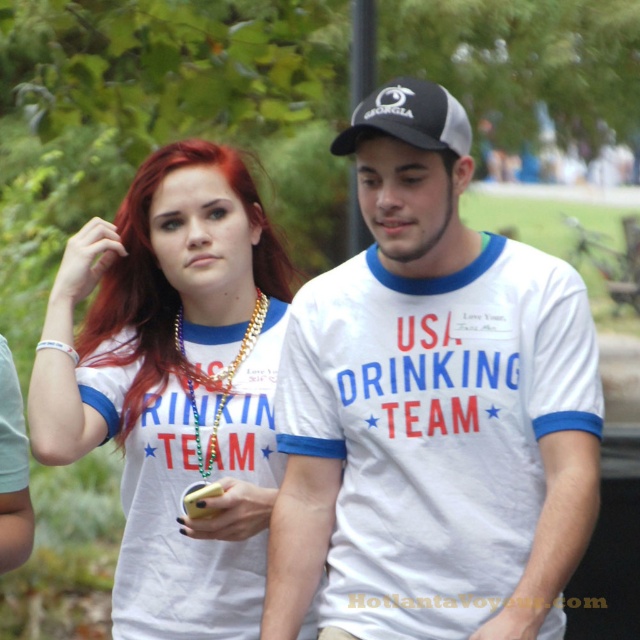
Question: Estimate the real-world distances between objects in this image. Which object is farther from the gold chain necklace at center?

Choices:
 (A) white cotton t-shirt at center
 (B) black mesh cap at upper center
 (C) white matte t-shirt at center

Answer: (B)

Question: Can you confirm if white cotton t-shirt at center is smaller than white matte t-shirt at center?

Choices:
 (A) no
 (B) yes

Answer: (A)

Question: Which object is positioned farthest from the white matte t-shirt at center?

Choices:
 (A) gold chain necklace at center
 (B) white cotton t-shirt at center

Answer: (B)

Question: Can you confirm if white cotton t-shirt at center is bigger than gold chain necklace at center?

Choices:
 (A) yes
 (B) no

Answer: (A)

Question: Is white cotton t-shirt at center closer to camera compared to white matte t-shirt at center?

Choices:
 (A) no
 (B) yes

Answer: (B)

Question: Which object is positioned farthest from the gold chain necklace at center?

Choices:
 (A) white matte t-shirt at center
 (B) white cotton t-shirt at center
 (C) black mesh cap at upper center

Answer: (C)